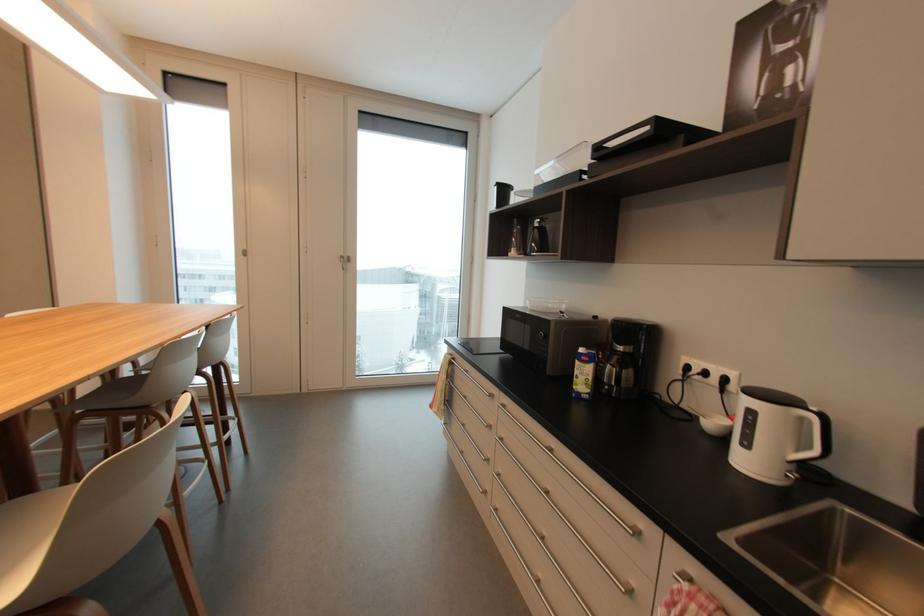
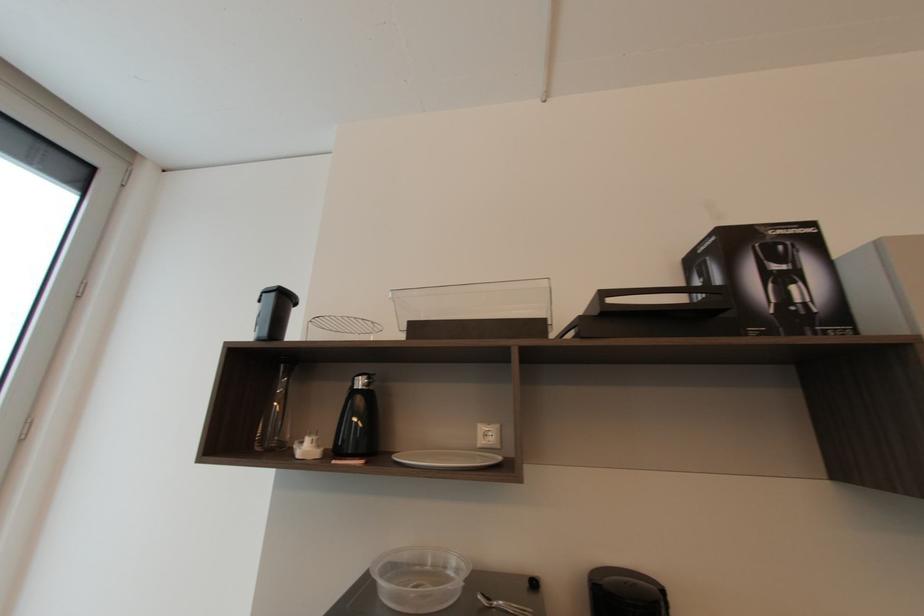
In the second image, find the point that corresponds to point 795,69 in the first image.

(796, 288)